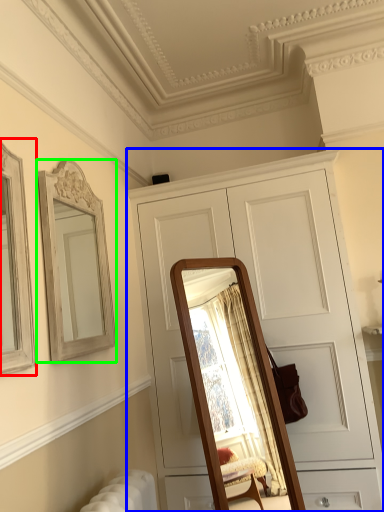
Question: Which object is positioned closest to picture frame (highlighted by a red box)? Select from cabinetry (highlighted by a blue box) and mirror (highlighted by a green box).

Choices:
 (A) cabinetry
 (B) mirror

Answer: (B)